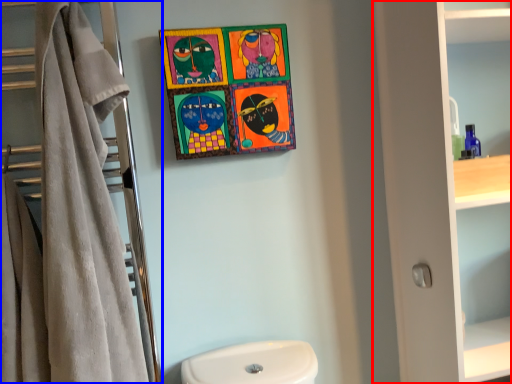
Question: Which object appears farthest to the camera in this image, bathroom cabinet (highlighted by a red box) or closet (highlighted by a blue box)?

Choices:
 (A) bathroom cabinet
 (B) closet

Answer: (A)